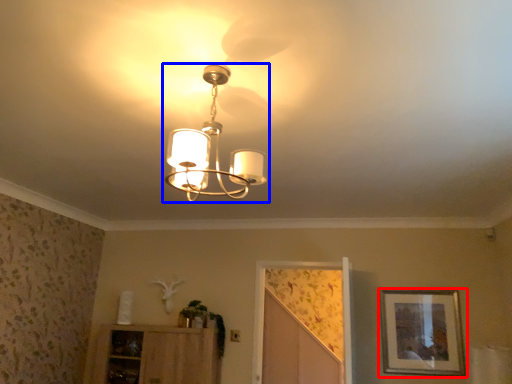
Question: Which of the following is the closest to the observer, picture frame (highlighted by a red box) or lamp (highlighted by a blue box)?

Choices:
 (A) picture frame
 (B) lamp

Answer: (B)